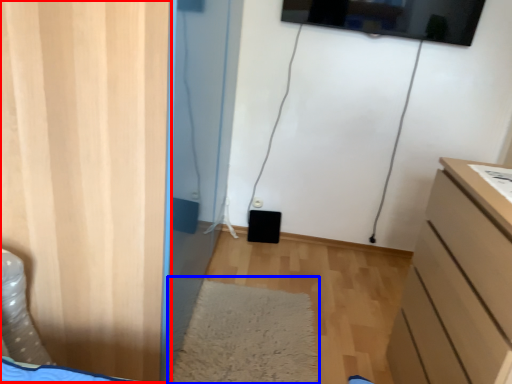
Question: Which object appears closest to the camera in this image, door (highlighted by a red box) or mat (highlighted by a blue box)?

Choices:
 (A) door
 (B) mat

Answer: (A)